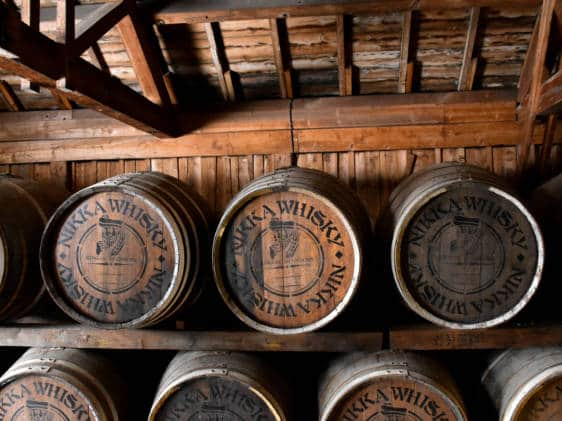
Locate an element on the screen. This screenshot has width=562, height=421. wooden wall is located at coordinates (238, 166).